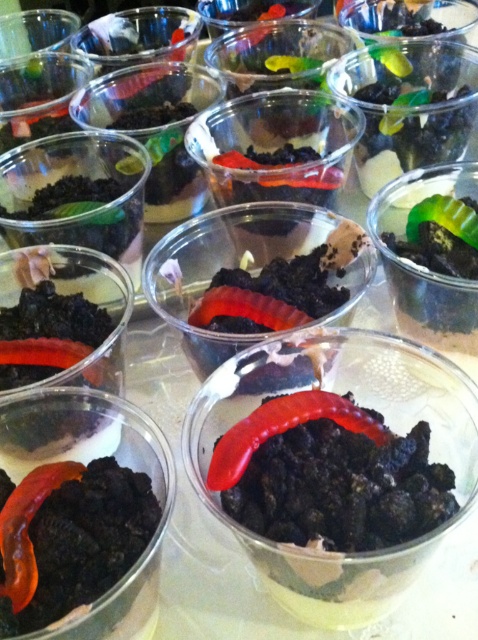
You are a chef preparing a dessert display and need to place a new green matte gummy worm on top of the matte plastic bowl at center. Can you do this without moving the existing green matte gummy worm at center?

The matte plastic bowl at center is located below the green matte gummy worm at center, so you can place the new green matte gummy worm on top of the bowl without moving the existing one.

You are a dessert chef preparing a display of dirt cakes. You have two gummy worms, a green matte gummy worm at center and a rubbery red worm at center. Which worm should you choose to place on top of the dirt cake to ensure it stands out more visually?

The green matte gummy worm at center has a larger size compared to the rubbery red worm at center, so it will stand out more visually when placed on top of the dirt cake.

You are a dessert chef preparing to serve a layered dessert. You have two containers available in the image, the matte plastic cup at center and the matte plastic bowl at center. Which container should you choose if you want to serve a larger portion of the dessert?

The matte plastic cup at center has a larger size compared to the matte plastic bowl at center, so you should choose the matte plastic cup at center to serve a larger portion of the dessert.